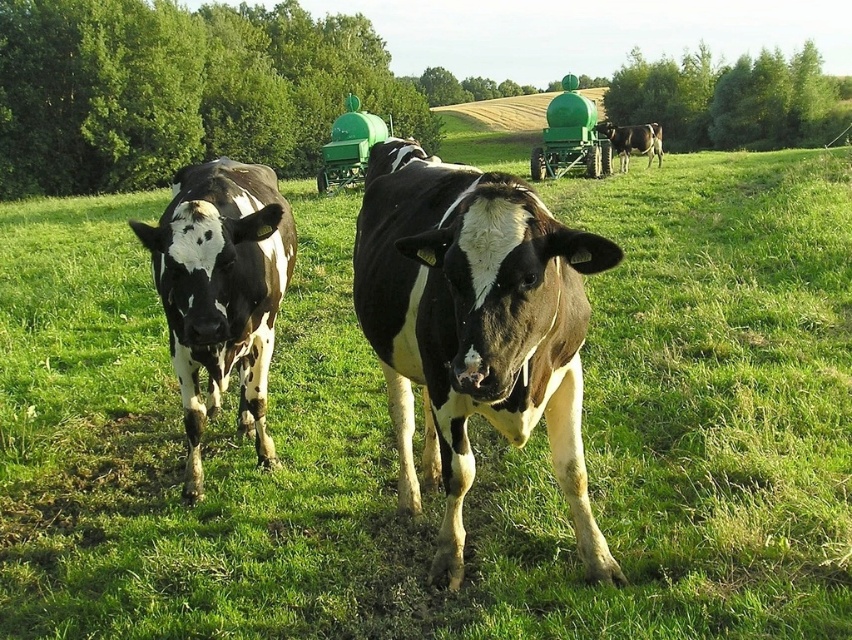
Question: Can you confirm if black and white cow at center is thinner than black and white cow at upper right?

Choices:
 (A) no
 (B) yes

Answer: (B)

Question: Is black and white cow at center positioned before black and white cow at upper right?

Choices:
 (A) yes
 (B) no

Answer: (A)

Question: From the image, what is the correct spatial relationship of black and white cow at center in relation to black and white spotted cow at left?

Choices:
 (A) right
 (B) left

Answer: (A)

Question: Among these points, which one is farthest from the camera?

Choices:
 (A) (620, 144)
 (B) (211, 280)
 (C) (439, 177)

Answer: (A)

Question: Which object is the closest to the black and white spotted cow at left?

Choices:
 (A) black and white cow at center
 (B) black and white cow at upper right

Answer: (A)

Question: Which is nearer to the black and white cow at center?

Choices:
 (A) black and white spotted cow at left
 (B) black and white cow at upper right

Answer: (A)